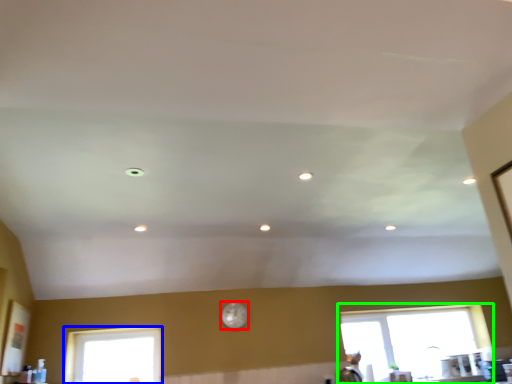
Question: Considering the real-world distances, which object is farthest from clock (highlighted by a red box)? window (highlighted by a blue box) or window (highlighted by a green box)?

Choices:
 (A) window
 (B) window

Answer: (B)